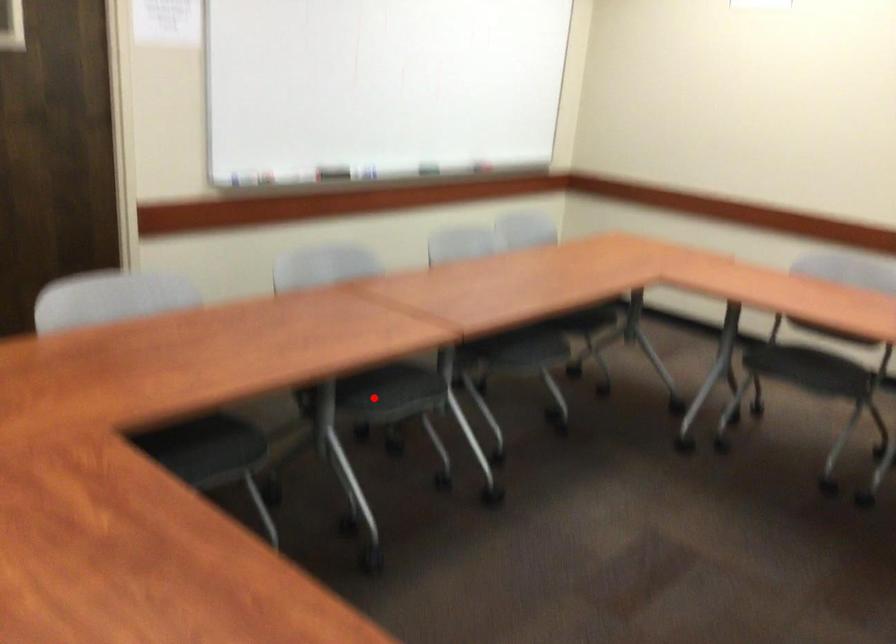
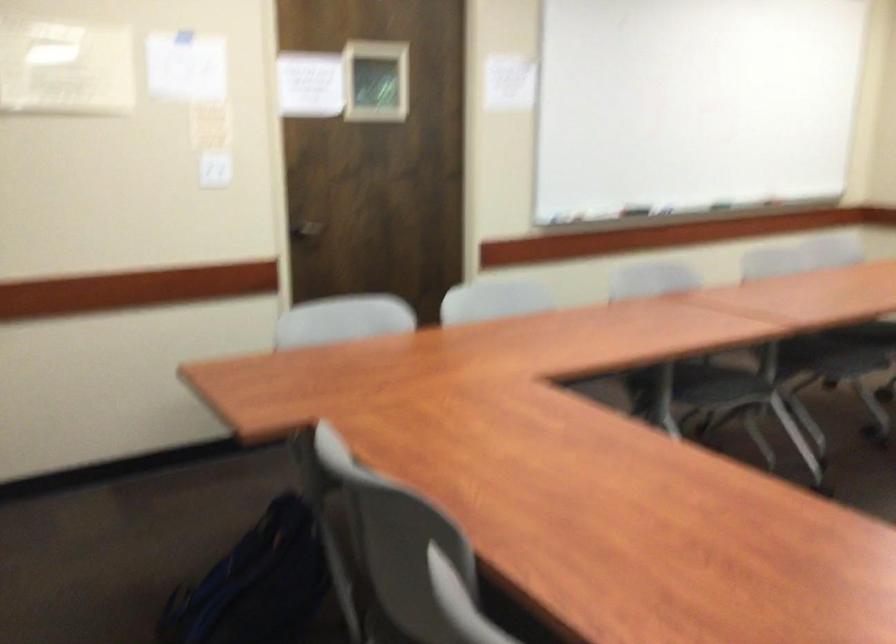
The point at the highlighted location is marked in the first image. Where is the corresponding point in the second image?

(712, 386)